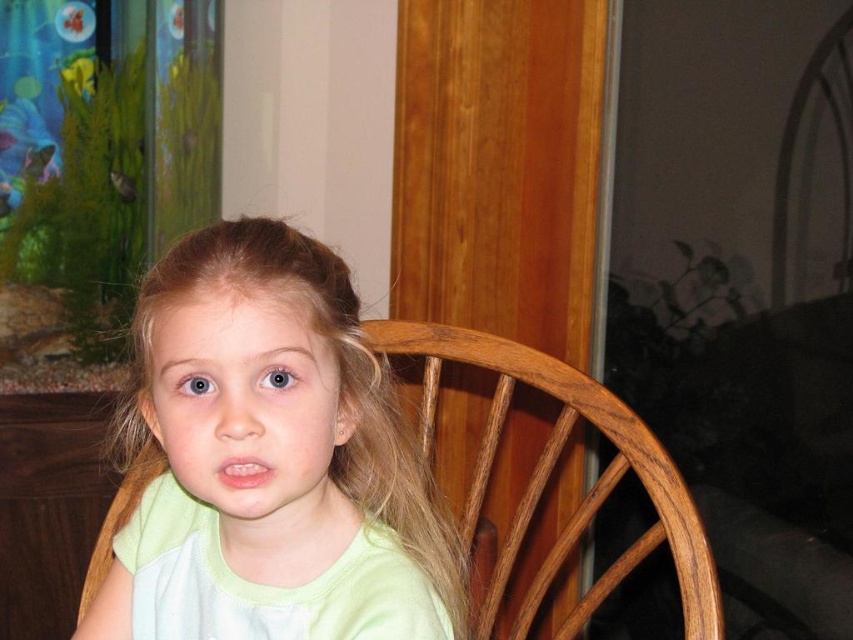
You are a visitor in this room and want to take a photo of the shiny green fish at upper left and the green matte fish at upper left through the aquarium glass. Which fish will appear closer to the camera in the photo?

The shiny green fish at upper left will appear closer to the camera in the photo because it is positioned closer to the viewer than the green matte fish at upper left.

You are a parent trying to point out two fish to your child in the aquarium. Which fish is located above the other between the shiny green fish at upper left and the shiny silver fish at upper left?

The shiny green fish at upper left is positioned over the shiny silver fish at upper left, so it is above the other.

You are standing in the room and want to sit down on the wooden chair at center. Based on its position, which direction should you move to reach it?

Since the wooden chair at center is located at point 0.741 on the x and 0.647 on the y, you should move towards the center of the room to reach it.